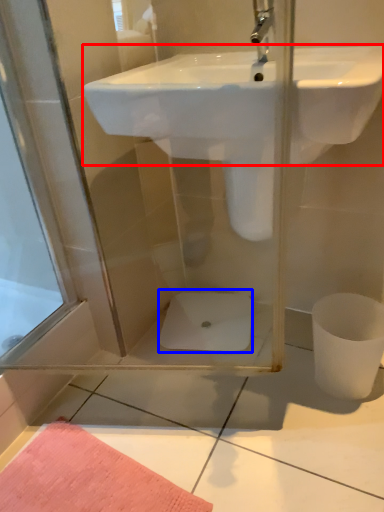
Question: Which object appears farthest to the camera in this image, sink (highlighted by a red box) or toilet bowl (highlighted by a blue box)?

Choices:
 (A) sink
 (B) toilet bowl

Answer: (B)